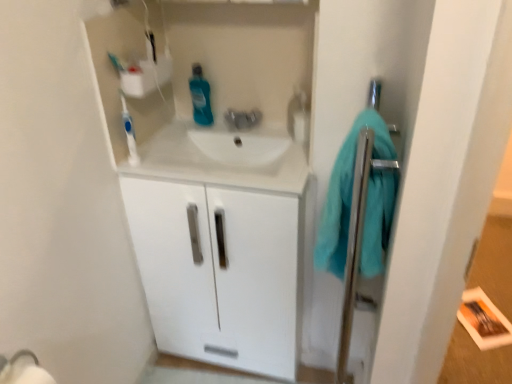
Find the location of `vacant space to the right of white plastic toothbrush at upper left`. vacant space to the right of white plastic toothbrush at upper left is located at coordinates (167, 167).